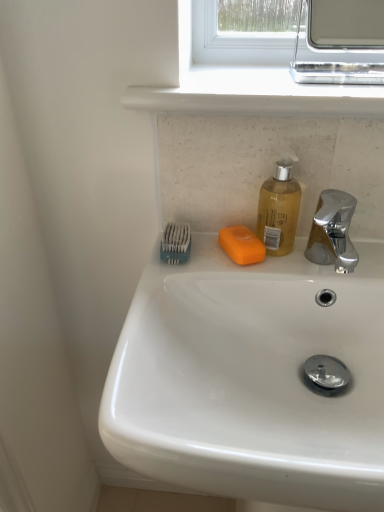
Question: Considering the positions of white glossy sink at center and blue plastic toothbrush at upper left in the image, is white glossy sink at center bigger or smaller than blue plastic toothbrush at upper left?

Choices:
 (A) big
 (B) small

Answer: (A)

Question: Is white glossy sink at center spatially inside blue plastic toothbrush at upper left, or outside of it?

Choices:
 (A) inside
 (B) outside

Answer: (B)

Question: Which is farther from the translucent yellow liquid at upper center?

Choices:
 (A) white smooth window sill at upper center
 (B) orange matte soap at center
 (C) blue plastic toothbrush at upper left
 (D) chrome metallic medicine cabinet at upper right
 (E) white glossy sink at center

Answer: (D)

Question: Which of these objects is positioned farthest from the translucent yellow liquid at upper center?

Choices:
 (A) blue plastic toothbrush at upper left
 (B) white smooth window sill at upper center
 (C) chrome metallic medicine cabinet at upper right
 (D) white glossy sink at center
 (E) orange matte soap at center

Answer: (C)